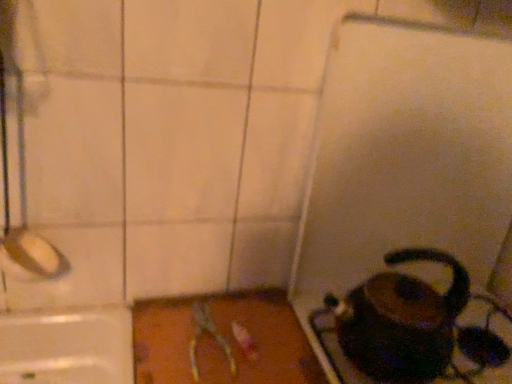
Question: Does metallic silver scissors at center have a greater height compared to shiny black kettle at lower right?

Choices:
 (A) no
 (B) yes

Answer: (A)

Question: Does metallic silver scissors at center have a larger size compared to shiny black kettle at lower right?

Choices:
 (A) yes
 (B) no

Answer: (B)

Question: Does metallic silver scissors at center have a greater width compared to shiny black kettle at lower right?

Choices:
 (A) no
 (B) yes

Answer: (B)

Question: From a real-world perspective, is metallic silver scissors at center physically above shiny black kettle at lower right?

Choices:
 (A) no
 (B) yes

Answer: (A)

Question: Is metallic silver scissors at center not near shiny black kettle at lower right?

Choices:
 (A) yes
 (B) no

Answer: (B)

Question: From a real-world perspective, is metallic silver scissors at center below shiny black kettle at lower right?

Choices:
 (A) no
 (B) yes

Answer: (B)

Question: Is shiny black kettle at lower right positioned behind metallic silver scissors at center?

Choices:
 (A) yes
 (B) no

Answer: (B)

Question: From the image's perspective, is shiny black kettle at lower right beneath metallic silver scissors at center?

Choices:
 (A) no
 (B) yes

Answer: (A)

Question: Is shiny black kettle at lower right oriented away from metallic silver scissors at center?

Choices:
 (A) yes
 (B) no

Answer: (B)

Question: Can you confirm if shiny black kettle at lower right is taller than metallic silver scissors at center?

Choices:
 (A) no
 (B) yes

Answer: (B)

Question: Is shiny black kettle at lower right located outside metallic silver scissors at center?

Choices:
 (A) yes
 (B) no

Answer: (A)

Question: Considering the relative sizes of shiny black kettle at lower right and metallic silver scissors at center in the image provided, is shiny black kettle at lower right wider than metallic silver scissors at center?

Choices:
 (A) no
 (B) yes

Answer: (A)

Question: Considering the positions of metallic silver scissors at center and shiny black kettle at lower right in the image, is metallic silver scissors at center wider or thinner than shiny black kettle at lower right?

Choices:
 (A) thin
 (B) wide

Answer: (B)